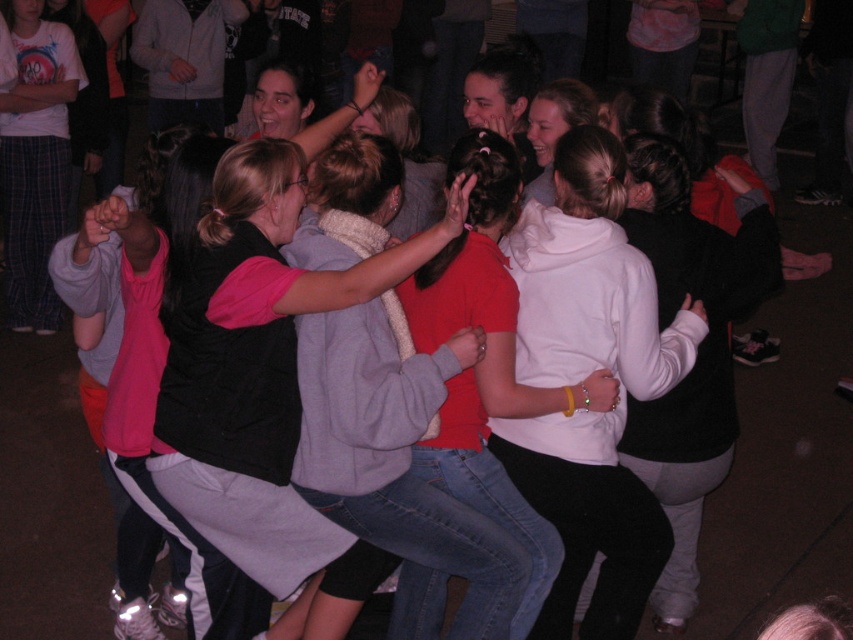
Which is below, white fleece hoodie at center or matte black vest at center?

Positioned lower is white fleece hoodie at center.

Is white fleece hoodie at center thinner than matte black vest at center?

Correct, white fleece hoodie at center's width is less than matte black vest at center's.

Between point (670, 352) and point (241, 333), which one is positioned in front?

Point (241, 333) is in front.

Identify the location of white fleece hoodie at center. Image resolution: width=853 pixels, height=640 pixels. (583, 378).